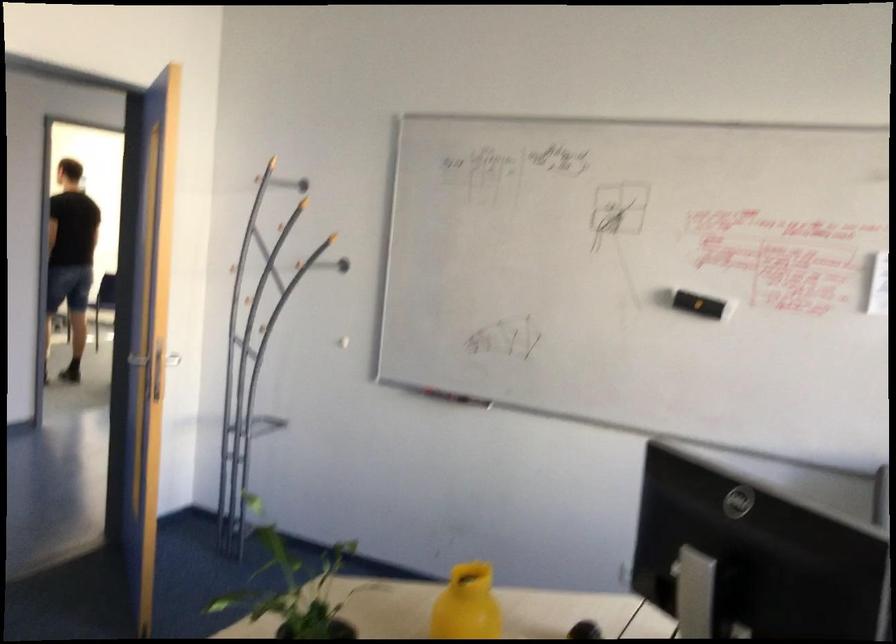
The location [294,589] corresponds to which object?

It refers to a small plant pot.